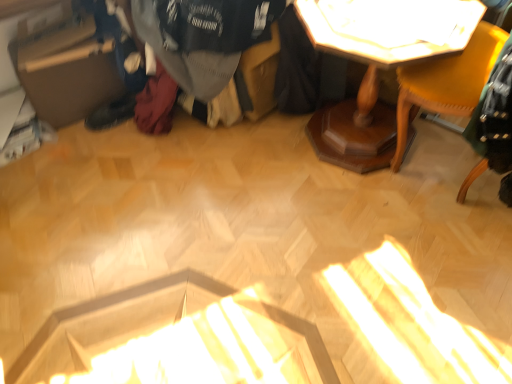
Where is `matte yellow chair at upper right`? matte yellow chair at upper right is located at coordinates (446, 82).

This screenshot has width=512, height=384. Describe the element at coordinates (66, 70) in the screenshot. I see `brown cardboard box at left` at that location.

What do you see at coordinates (390, 27) in the screenshot? I see `white glossy table at upper center` at bounding box center [390, 27].

This screenshot has height=384, width=512. What do you see at coordinates (390, 28) in the screenshot?
I see `wooden table at upper right` at bounding box center [390, 28].

Where is `matte yellow chair at upper right`? Image resolution: width=512 pixels, height=384 pixels. matte yellow chair at upper right is located at coordinates (446, 82).

Is matte yellow chair at upper right to the left of dark gray sweater at center from the viewer's perspective?

No, matte yellow chair at upper right is not to the left of dark gray sweater at center.

Would you say matte yellow chair at upper right is outside dark gray sweater at center?

Yes.

From the image's perspective, is matte yellow chair at upper right under dark gray sweater at center?

Yes.

Between matte yellow chair at upper right and dark gray sweater at center, which one has larger size?

Bigger between the two is dark gray sweater at center.

From the picture: Is wooden table at upper right shorter than brown cardboard box at left?

Incorrect, the height of wooden table at upper right does not fall short of that of brown cardboard box at left.

Do you think wooden table at upper right is within brown cardboard box at left, or outside of it?

wooden table at upper right is outside brown cardboard box at left.

Where is `cardboard box located underneath the wooden table at upper right (from a real-world perspective)`? The width and height of the screenshot is (512, 384). cardboard box located underneath the wooden table at upper right (from a real-world perspective) is located at coordinates (66, 70).

Could you tell me if wooden table at upper right is facing brown cardboard box at left?

Yes, wooden table at upper right is oriented towards brown cardboard box at left.

Is matte yellow chair at upper right closer to camera compared to wooden table at upper right?

Yes, matte yellow chair at upper right is in front of wooden table at upper right.

Locate an element on the screen. This screenshot has height=384, width=512. table that is on the left side of matte yellow chair at upper right is located at coordinates (390, 28).

Considering the sizes of objects matte yellow chair at upper right and wooden table at upper right in the image provided, who is thinner, matte yellow chair at upper right or wooden table at upper right?

matte yellow chair at upper right.

Is wooden table at upper right located within matte yellow chair at upper right?

No, wooden table at upper right is not a part of matte yellow chair at upper right.

In the image, is wooden table at upper right positioned in front of or behind dark gray sweater at center?

In the image, wooden table at upper right appears in front of dark gray sweater at center.

Is wooden table at upper right at the left side of dark gray sweater at center?

No.

Is wooden table at upper right oriented away from dark gray sweater at center?

wooden table at upper right does not have its back to dark gray sweater at center.

Considering the relative sizes of wooden table at upper right and dark gray sweater at center in the image provided, is wooden table at upper right taller than dark gray sweater at center?

Yes, wooden table at upper right is taller than dark gray sweater at center.

Which object is thinner, white glossy table at upper center or dark gray sweater at center?

With smaller width is white glossy table at upper center.

From a real-world perspective, between white glossy table at upper center and dark gray sweater at center, who is vertically higher?

white glossy table at upper center, from a real-world perspective.

Based on their sizes in the image, would you say white glossy table at upper center is bigger or smaller than dark gray sweater at center?

Considering their sizes, white glossy table at upper center takes up less space than dark gray sweater at center.

Is dark gray sweater at center closer to camera compared to matte yellow chair at upper right?

No.

Where is `clothing located above the matte yellow chair at upper right (from the image's perspective)`? clothing located above the matte yellow chair at upper right (from the image's perspective) is located at coordinates (203, 37).

Considering the relative sizes of dark gray sweater at center and matte yellow chair at upper right in the image provided, is dark gray sweater at center bigger than matte yellow chair at upper right?

Yes, dark gray sweater at center is bigger than matte yellow chair at upper right.

Is dark gray sweater at center beside matte yellow chair at upper right?

No, dark gray sweater at center is not making contact with matte yellow chair at upper right.

Who is shorter, brown cardboard box at left or wooden table at upper right?

With less height is brown cardboard box at left.

Which is correct: brown cardboard box at left is inside wooden table at upper right, or outside of it?

brown cardboard box at left cannot be found inside wooden table at upper right.

From a real-world perspective, is brown cardboard box at left located higher than wooden table at upper right?

Incorrect, from a real-world perspective, brown cardboard box at left is lower than wooden table at upper right.

Is brown cardboard box at left not close to wooden table at upper right?

brown cardboard box at left is far away from wooden table at upper right.

Identify the location of clothing that appears above the matte yellow chair at upper right (from a real-world perspective). (203, 37).

Locate an element on the screen. This screenshot has height=384, width=512. cardboard box behind the wooden table at upper right is located at coordinates (66, 70).

Based on the photo, considering their positions, is brown cardboard box at left positioned further to wooden table at upper right than dark gray sweater at center?

brown cardboard box at left.

From the image, which object appears to be farther from white glossy table at upper center, dark gray sweater at center or wooden table at upper right?

dark gray sweater at center is further to white glossy table at upper center.

When comparing their distances from wooden table at upper right, does matte yellow chair at upper right or brown cardboard box at left seem further?

brown cardboard box at left is further to wooden table at upper right.

From the picture: Estimate the real-world distances between objects in this image. Which object is further from brown cardboard box at left, dark gray sweater at center or matte yellow chair at upper right?

matte yellow chair at upper right is positioned further to the anchor brown cardboard box at left.

Based on their spatial positions, is dark gray sweater at center or wooden table at upper right closer to brown cardboard box at left?

Among the two, dark gray sweater at center is located nearer to brown cardboard box at left.

Based on their spatial positions, is wooden table at upper right or white glossy table at upper center closer to matte yellow chair at upper right?

wooden table at upper right.

Considering their positions, is white glossy table at upper center positioned further to wooden table at upper right than brown cardboard box at left?

A: Based on the image, brown cardboard box at left appears to be further to wooden table at upper right.

From the image, which object appears to be nearer to matte yellow chair at upper right, brown cardboard box at left or wooden table at upper right?

wooden table at upper right is closer to matte yellow chair at upper right.

Find the location of a particular element. Image resolution: width=512 pixels, height=384 pixels. table top between dark gray sweater at center and matte yellow chair at upper right from left to right is located at coordinates (390, 27).

The image size is (512, 384). I want to click on table top situated between brown cardboard box at left and matte yellow chair at upper right from left to right, so click(x=390, y=27).

Identify the location of table located between dark gray sweater at center and matte yellow chair at upper right in the left-right direction. (390, 28).

This screenshot has width=512, height=384. I want to click on clothing between brown cardboard box at left and wooden table at upper right from left to right, so click(x=203, y=37).